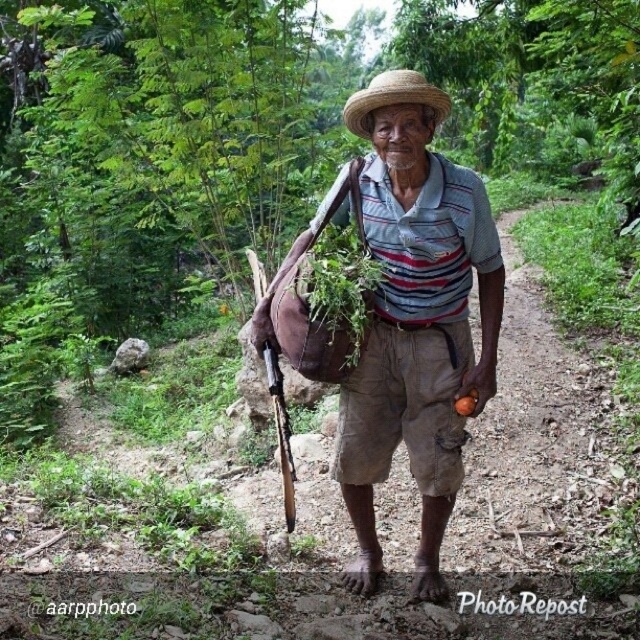
Between point (397, 122) and point (403, 90), which one is positioned in front?

Point (403, 90) is in front.

Does brown woven hat at center have a lesser width compared to strawmaterial/texturehat at center?

Correct, brown woven hat at center's width is less than strawmaterial/texturehat at center's.

Who is more forward, (396, 340) or (381, 77)?

Point (381, 77) is more forward.

At what (x,y) coordinates should I click in order to perform the action: click on brown woven hat at center. Please return your answer as a coordinate pair (x, y). Looking at the image, I should click on (416, 320).